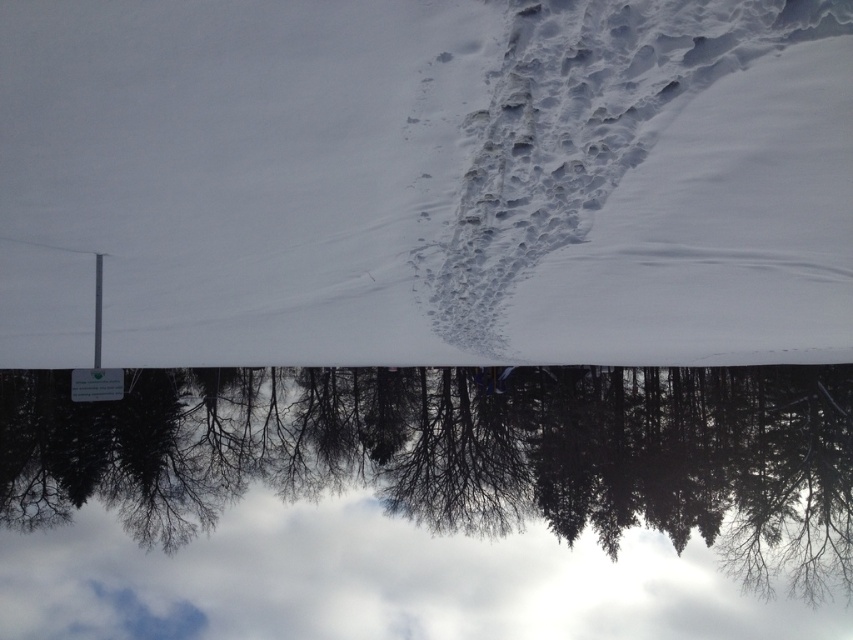
Question: Which of the following is the closest to the observer?

Choices:
 (A) (346, 372)
 (B) (47, 262)

Answer: (B)

Question: Is white powdery snow at center thinner than silvery metallic trees at center?

Choices:
 (A) yes
 (B) no

Answer: (A)

Question: Observing the image, what is the correct spatial positioning of white powdery snow at center in reference to silvery metallic trees at center?

Choices:
 (A) below
 (B) above

Answer: (B)

Question: Which object appears closest to the camera in this image?

Choices:
 (A) white powdery snow at center
 (B) silvery metallic trees at center

Answer: (A)

Question: Does white powdery snow at center have a greater width compared to silvery metallic trees at center?

Choices:
 (A) yes
 (B) no

Answer: (B)